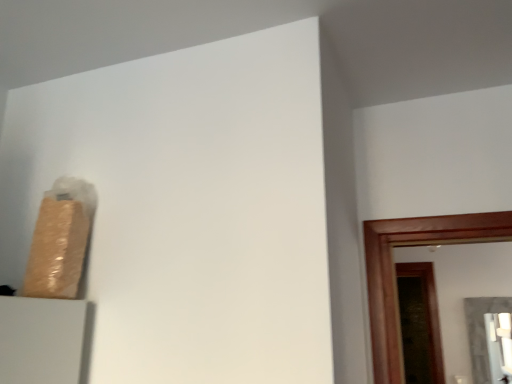
Image resolution: width=512 pixels, height=384 pixels. I want to click on brown plastic bag at left, so (60, 240).

This screenshot has height=384, width=512. Describe the element at coordinates (60, 240) in the screenshot. I see `brown plastic bag at left` at that location.

This screenshot has width=512, height=384. In order to click on brown plastic bag at left in this screenshot , I will do `click(60, 240)`.